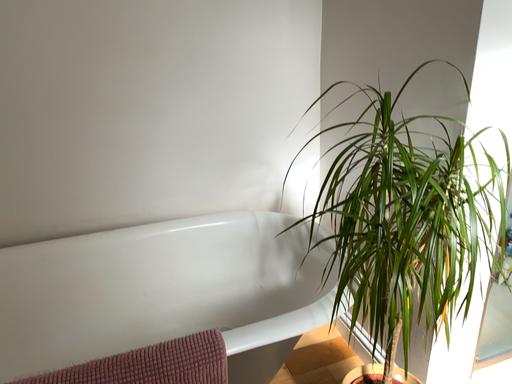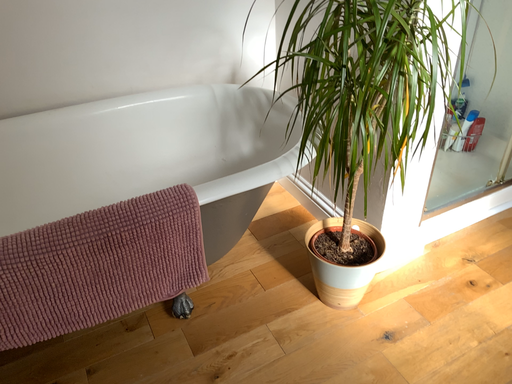
Question: How did the camera likely rotate when shooting the video?

Choices:
 (A) rotated left
 (B) rotated right

Answer: (B)